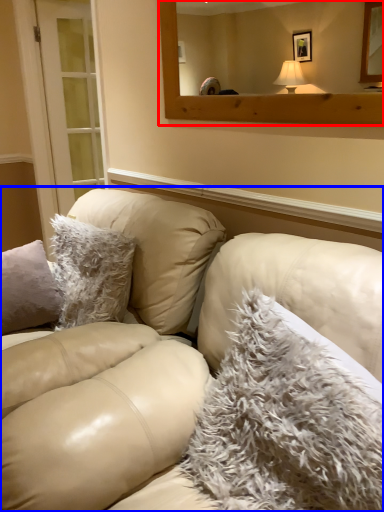
Question: Which of the following is the closest to the observer, mirror (highlighted by a red box) or studio couch (highlighted by a blue box)?

Choices:
 (A) mirror
 (B) studio couch

Answer: (B)